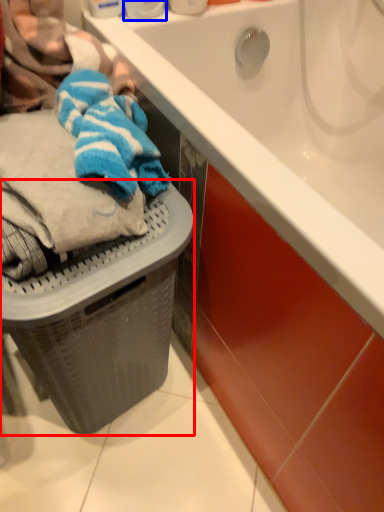
Question: Which object is closer to the camera taking this photo, basket container (highlighted by a red box) or toiletry (highlighted by a blue box)?

Choices:
 (A) basket container
 (B) toiletry

Answer: (A)